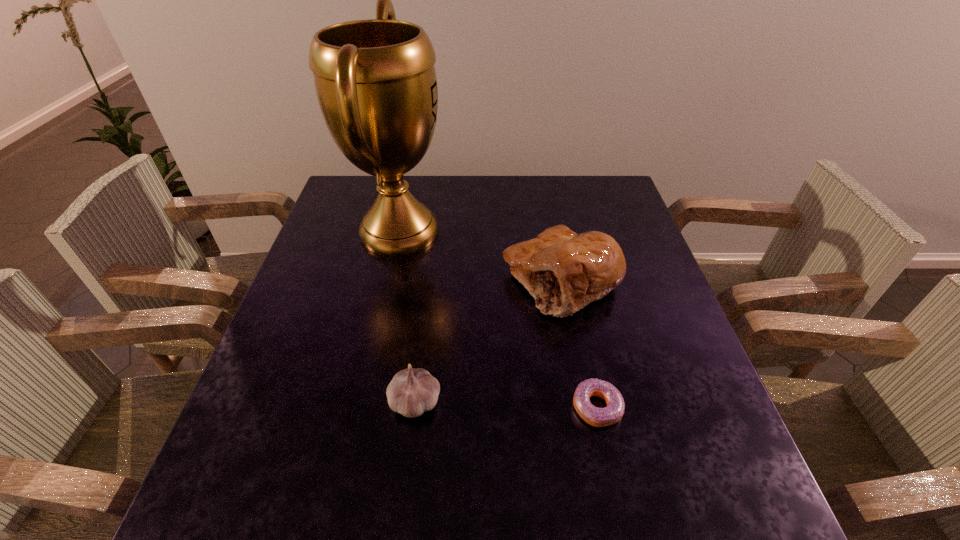
Locate an element on the screen. object situated at the far edge is located at coordinates (375, 79).

The width and height of the screenshot is (960, 540). In order to click on object that is at the left edge in this screenshot , I will do `click(375, 79)`.

Identify the location of object located in the right edge section of the desktop. (564, 271).

Locate an element on the screen. The height and width of the screenshot is (540, 960). object at the far left corner is located at coordinates (375, 79).

Image resolution: width=960 pixels, height=540 pixels. In order to click on free space at the far edge in this screenshot , I will do `click(557, 188)`.

This screenshot has width=960, height=540. In the image, there is a desktop. What are the coordinates of `vacant region at the near edge` in the screenshot? It's located at (342, 527).

In the image, there is a desktop. Where is `vacant area at the left edge`? This screenshot has height=540, width=960. vacant area at the left edge is located at coordinates (279, 440).

Locate an element on the screen. The image size is (960, 540). free spot at the right edge of the desktop is located at coordinates (725, 456).

Where is `vacant area at the far right corner of the desktop`? vacant area at the far right corner of the desktop is located at coordinates (618, 205).

Where is `unoccupied area between the bread and the trophy cup`? unoccupied area between the bread and the trophy cup is located at coordinates (480, 256).